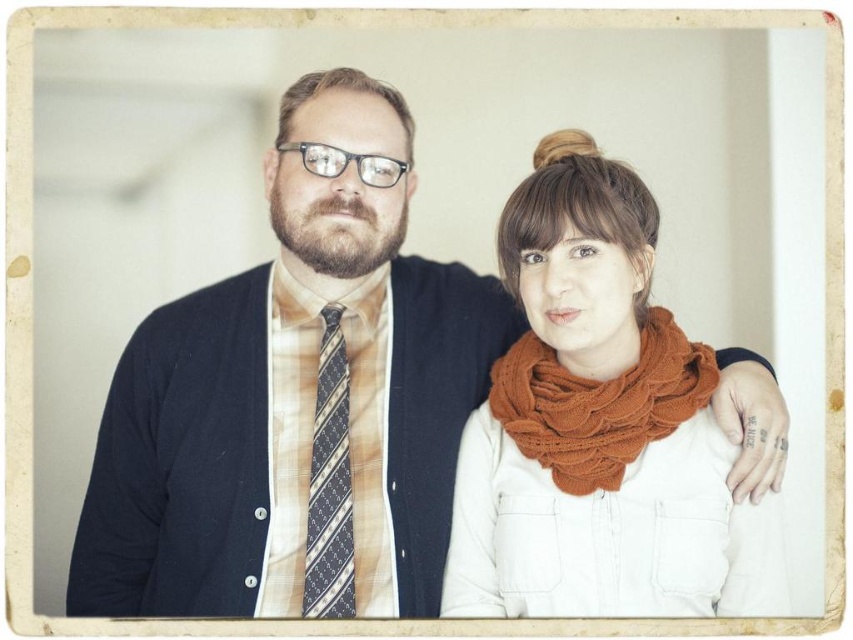
You are a photographer setting up for a portrait. You notice the knitted orange scarf at center and the blue striped tie at center in the frame. Which of these two items is positioned to the right side of the other?

The knitted orange scarf at center is to the right of the blue striped tie at center.

You are a tailor measuring the distance between two items in the image. The items are the matte black sweater at left and the knitted orange scarf at center. The minimum space required for a small alteration is 12 inches. Can the alteration be done without moving either item?

The matte black sweater at left is only 10.95 inches from the knitted orange scarf at center. Since this distance is less than the required 12 inches, the alteration cannot be done without moving either item.

You are an interior designer and need to place a new sofa in a room. The sofa must be positioned exactly at point 0.623, 0.349. You have a sofa labeled as matte black sweater at left. Can you use this sofa for the placement?

The position of matte black sweater at left is at point (297, 397), so yes, you can use the matte black sweater at left as the sofa for the placement since it is already positioned at the required coordinates.